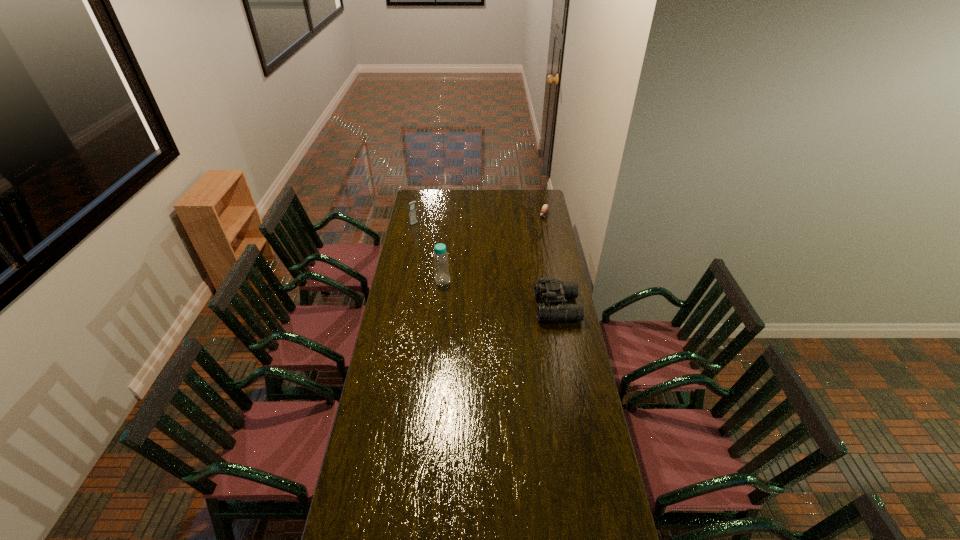
The width and height of the screenshot is (960, 540). Find the location of `bottle`. bottle is located at coordinates (441, 262).

Identify the location of the second nearest object. This screenshot has height=540, width=960. (441, 262).

The height and width of the screenshot is (540, 960). I want to click on binoculars, so click(553, 290).

Identify the location of the leftmost object. The width and height of the screenshot is (960, 540). (412, 212).

The height and width of the screenshot is (540, 960). Find the location of `cellular telephone`. cellular telephone is located at coordinates (412, 212).

Where is `the shortest object`? the shortest object is located at coordinates (545, 207).

Where is `the farthest object`? the farthest object is located at coordinates (545, 207).

Where is `free spot located on the right of the second object from left to right`? free spot located on the right of the second object from left to right is located at coordinates (484, 280).

What are the coordinates of `vacant area situated 0.130m through the lenses of the binoculars` in the screenshot? It's located at (510, 307).

The image size is (960, 540). In order to click on free space located through the lenses of the binoculars in this screenshot , I will do `click(492, 307)`.